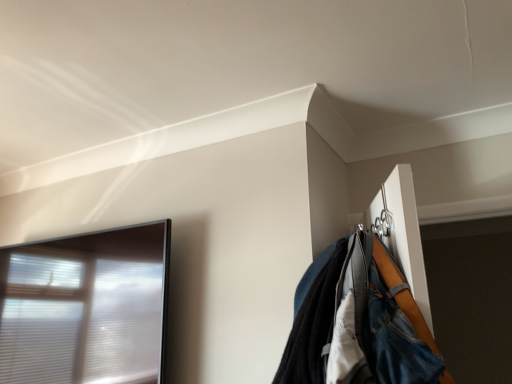
Question: Is point (312, 357) positioned closer to the camera than point (10, 380)?

Choices:
 (A) farther
 (B) closer

Answer: (B)

Question: From a real-world perspective, is denim jacket at upper right physically located above or below transparent glass window at left?

Choices:
 (A) below
 (B) above

Answer: (A)

Question: Considering the relative positions of denim jacket at upper right and transparent glass window at left in the image provided, is denim jacket at upper right to the left or to the right of transparent glass window at left?

Choices:
 (A) left
 (B) right

Answer: (B)

Question: Considering the relative positions of transparent glass window at left and denim jacket at upper right in the image provided, is transparent glass window at left to the left or to the right of denim jacket at upper right?

Choices:
 (A) left
 (B) right

Answer: (A)

Question: Do you think transparent glass window at left is within denim jacket at upper right, or outside of it?

Choices:
 (A) inside
 (B) outside

Answer: (B)

Question: From a real-world perspective, is transparent glass window at left positioned above or below denim jacket at upper right?

Choices:
 (A) below
 (B) above

Answer: (B)

Question: Considering the positions of transparent glass window at left and denim jacket at upper right in the image, is transparent glass window at left bigger or smaller than denim jacket at upper right?

Choices:
 (A) small
 (B) big

Answer: (B)